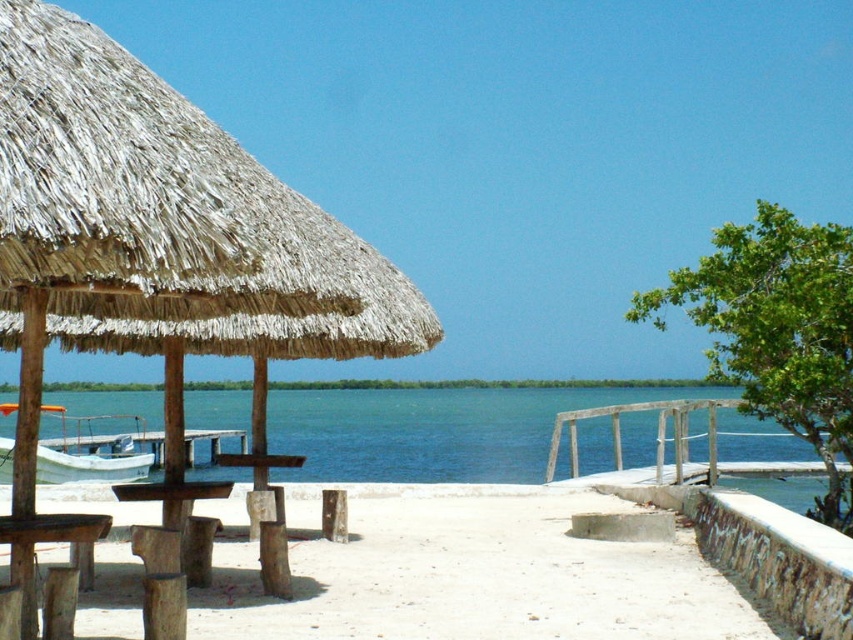
Question: Is blue water at center further to camera compared to white matte boat at lower left?

Choices:
 (A) yes
 (B) no

Answer: (A)

Question: Considering the relative positions of thatched straw umbrella at left and smooth concrete beach at center in the image provided, where is thatched straw umbrella at left located with respect to smooth concrete beach at center?

Choices:
 (A) above
 (B) below

Answer: (A)

Question: Considering the real-world distances, which object is closest to the smooth concrete beach at center?

Choices:
 (A) white matte boat at lower left
 (B) blue water at center

Answer: (A)

Question: Which point is farther from the camera taking this photo?

Choices:
 (A) (416, 392)
 (B) (358, 637)

Answer: (A)

Question: Which of these objects is positioned closest to the white matte boat at lower left?

Choices:
 (A) smooth concrete beach at center
 (B) blue water at center
 (C) thatched straw umbrella at left

Answer: (C)

Question: Observing the image, what is the correct spatial positioning of thatched straw umbrella at left in reference to blue water at center?

Choices:
 (A) right
 (B) left

Answer: (B)